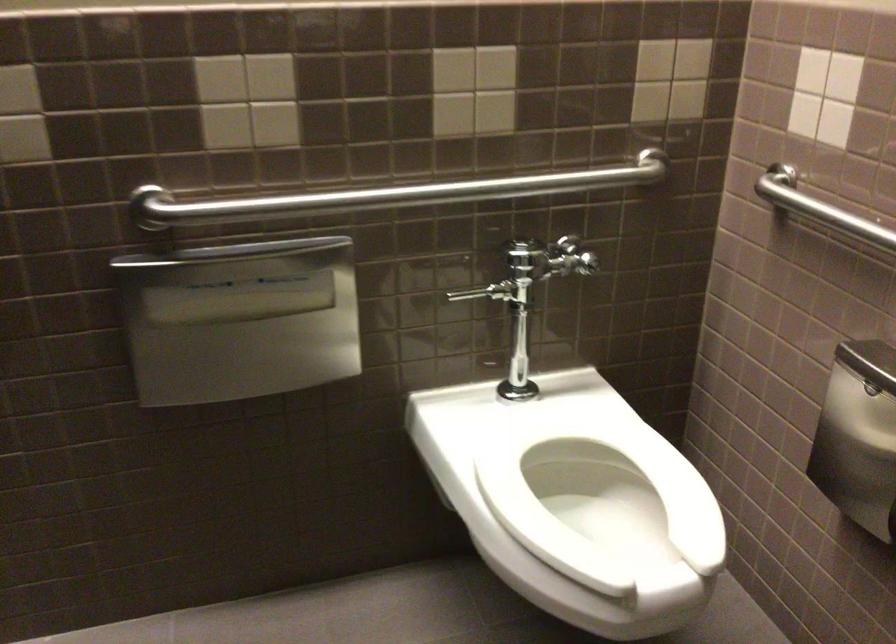
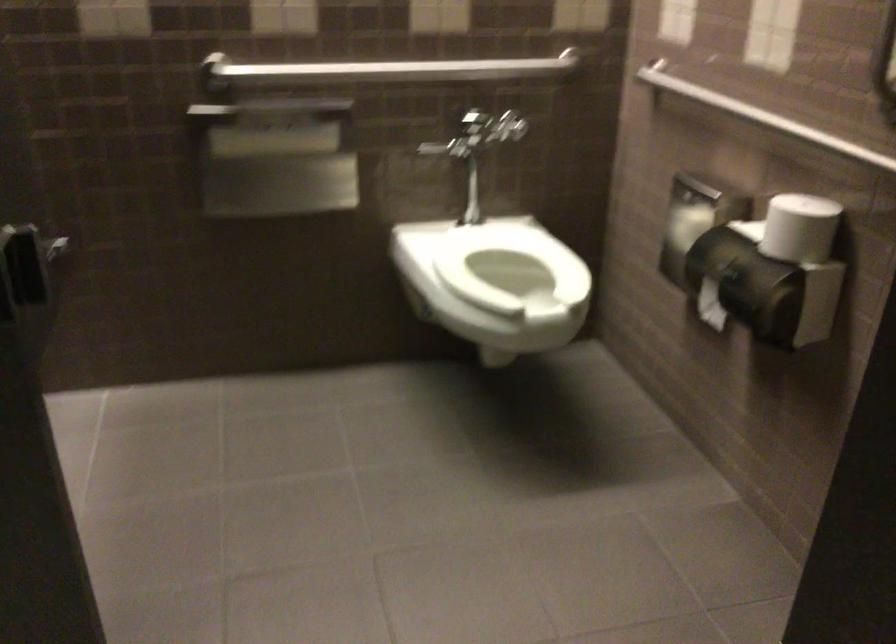
Question: The first image is from the beginning of the video and the second image is from the end. How did the camera likely rotate when shooting the video?

Choices:
 (A) Left
 (B) Right
 (C) Up
 (D) Down

Answer: (D)